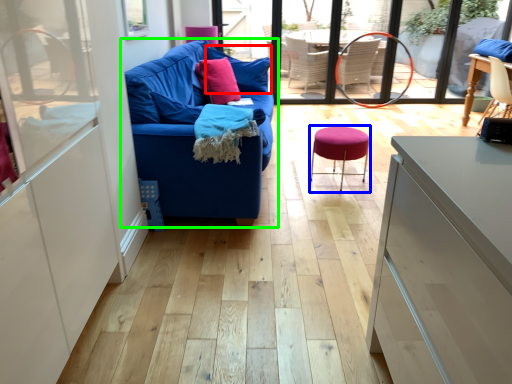
Question: Estimate the real-world distances between objects in this image. Which object is closer to pillow (highlighted by a red box), bar stool (highlighted by a blue box) or studio couch (highlighted by a green box)?

Choices:
 (A) bar stool
 (B) studio couch

Answer: (B)